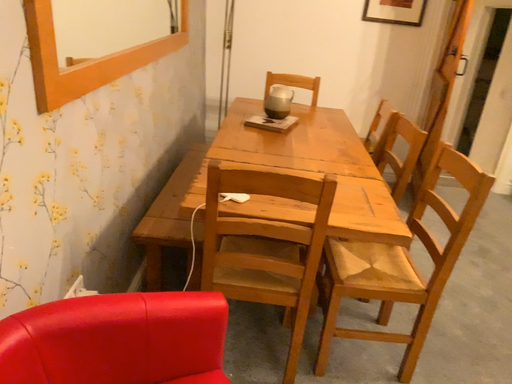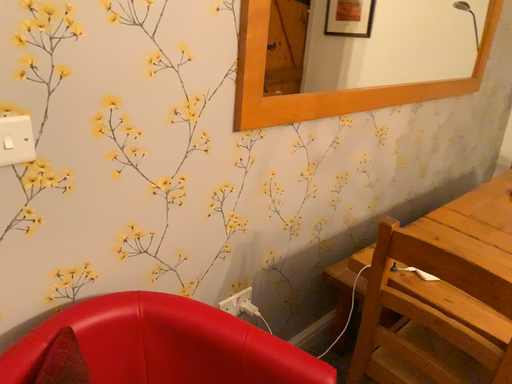
Question: Which way did the camera rotate in the video?

Choices:
 (A) rotated upward
 (B) rotated downward

Answer: (A)